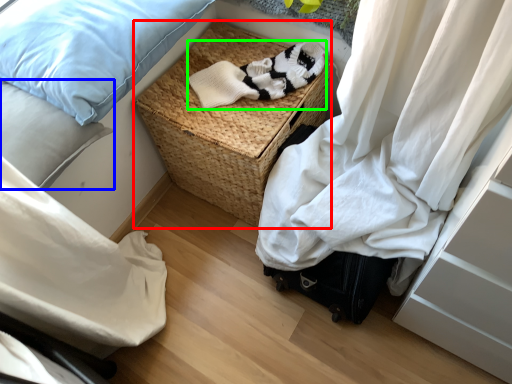
Question: Which object is the closest to the picnic basket (highlighted by a red box)? Choose among these: pillow (highlighted by a blue box) or clothing (highlighted by a green box).

Choices:
 (A) pillow
 (B) clothing

Answer: (B)